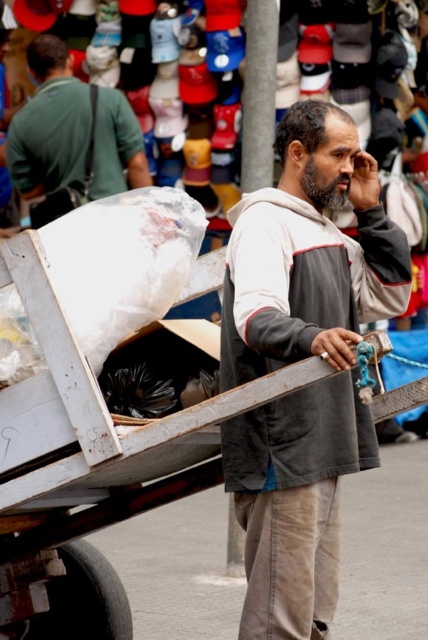
You are a fashion designer observing a street scene. You notice the gray cotton hoodie at center and the matte green shirt at upper left. Which clothing item is positioned lower in the image?

The gray cotton hoodie at center is located below matte green shirt at upper left, so the gray cotton hoodie at center is positioned lower in the image.

You are a delivery person who needs to deliver a package to the matte green shirt at upper left. You are currently located at the gray cotton hoodie at center. Can you walk straight to the destination without any obstacles?

The distance between the gray cotton hoodie at center and the matte green shirt at upper left is 27.21 meters. Since there are no mentioned obstacles in the scene, you can walk straight to the destination.

You are standing at the edge of the street and see the gray cotton hoodie at center. There is a stop sign 50 feet away from you. Can you safely cross the street before the man reaches the stop sign?

The gray cotton hoodie at center is 54.86 feet away from you. The stop sign is only 50 feet away, so the man will reach the stop sign before you can safely cross the street.